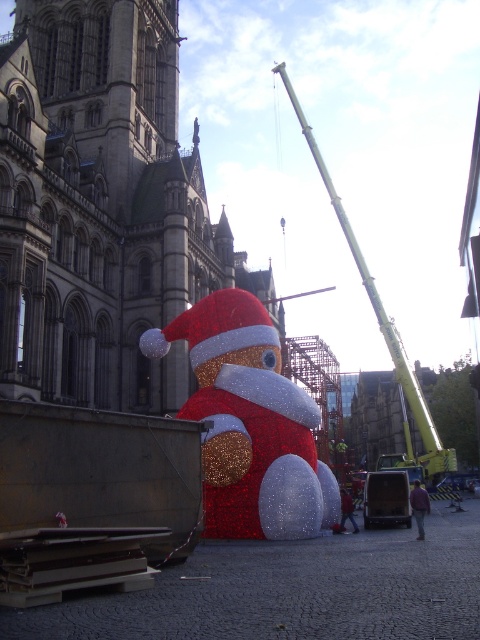
Is shiny metallic santa at center above metallic yellow crane at center?

Yes, shiny metallic santa at center is above metallic yellow crane at center.

Who is lower down, shiny metallic santa at center or metallic yellow crane at center?

metallic yellow crane at center is below.

Who is more forward, (x=255, y=497) or (x=369, y=528)?

Point (x=255, y=497)

At what (x,y) coordinates should I click in order to perform the action: click on shiny metallic santa at center. Please return your answer as a coordinate pair (x, y). Looking at the image, I should click on (250, 422).

Which is more to the left, stone tower at center or shiny metallic santa at center?

stone tower at center

Consider the image. Is stone tower at center to the right of shiny metallic santa at center from the viewer's perspective?

No, stone tower at center is not to the right of shiny metallic santa at center.

Locate an element on the screen. This screenshot has width=480, height=640. stone tower at center is located at coordinates (100, 205).

Based on the photo, between green metallic crane at upper right and metallic yellow crane at center, which one has more height?

Standing taller between the two is green metallic crane at upper right.

Which is below, green metallic crane at upper right or metallic yellow crane at center?

metallic yellow crane at center is lower down.

The width and height of the screenshot is (480, 640). In order to click on green metallic crane at upper right in this screenshot , I will do [x=383, y=324].